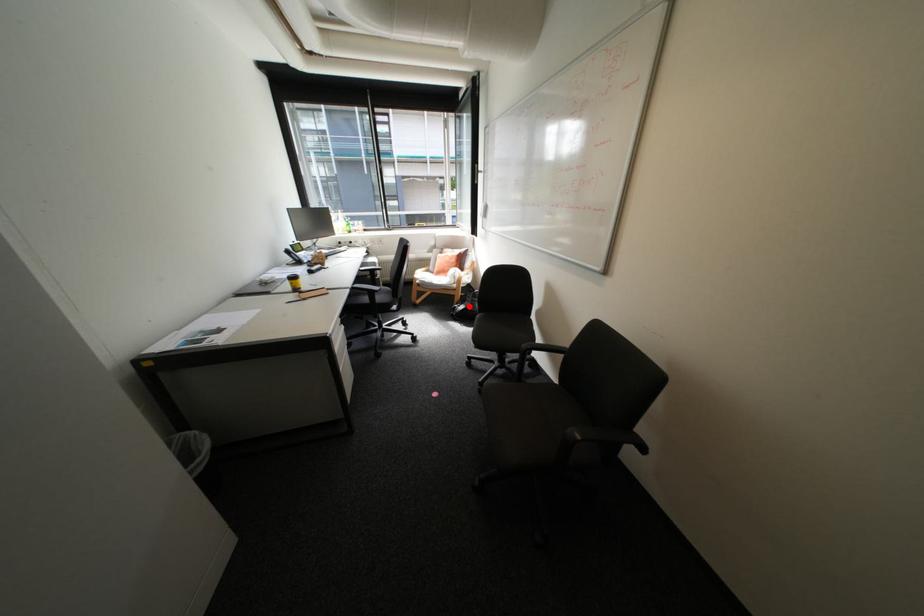
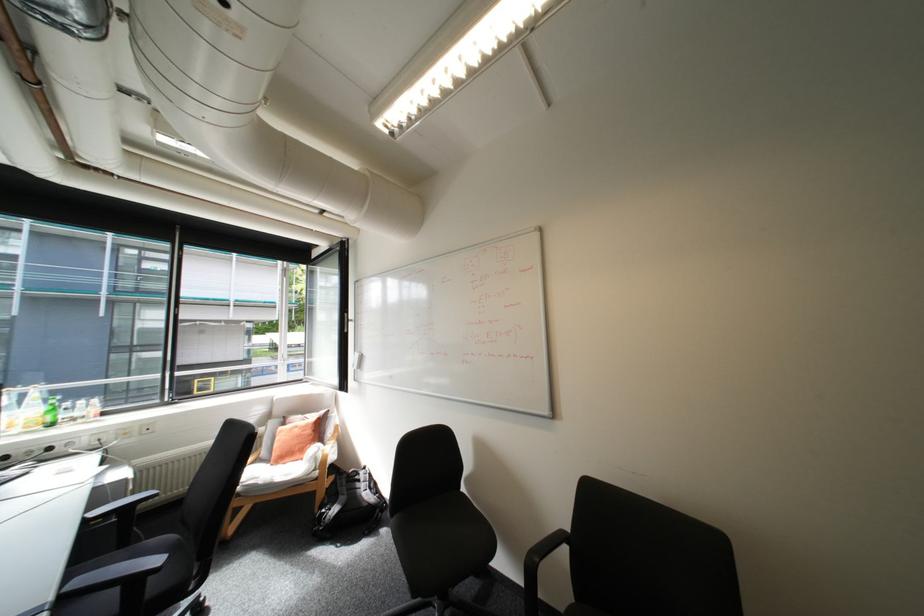
Question: I am providing you with two images of the same scene from different viewpoints. A red point is marked on the first image. Is the red point's position out of view in image 2?

Choices:
 (A) Yes
 (B) No

Answer: (B)